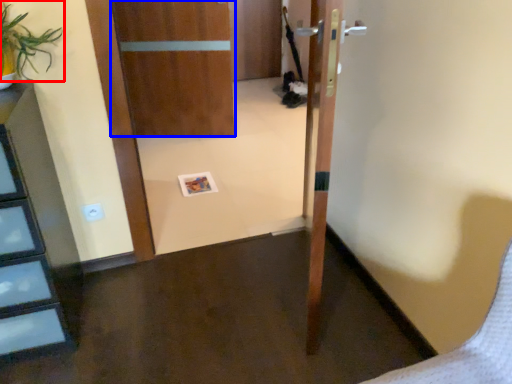
Question: Which object appears farthest to the camera in this image, plant (highlighted by a red box) or door (highlighted by a blue box)?

Choices:
 (A) plant
 (B) door

Answer: (B)